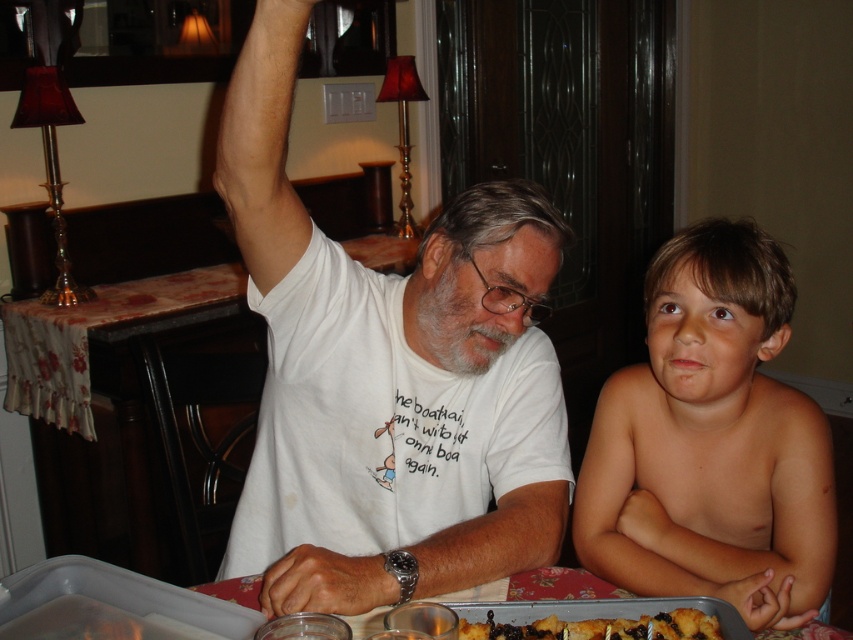
Question: Among these points, which one is nearest to the camera?

Choices:
 (A) (677, 630)
 (B) (734, 461)
 (C) (457, 512)

Answer: (A)

Question: Which object is farther from the camera taking this photo?

Choices:
 (A) smooth skin boy at right
 (B) white t-shirt at center

Answer: (A)

Question: From the image, what is the correct spatial relationship of white t-shirt at center in relation to smooth skin boy at right?

Choices:
 (A) below
 (B) above

Answer: (B)

Question: Does white t-shirt at center appear under smooth skin boy at right?

Choices:
 (A) no
 (B) yes

Answer: (A)

Question: Which object appears closest to the camera in this image?

Choices:
 (A) golden brown cake at lower center
 (B) white t-shirt at center
 (C) smooth skin boy at right

Answer: (B)

Question: Does white t-shirt at center lie behind golden brown cake at lower center?

Choices:
 (A) no
 (B) yes

Answer: (A)